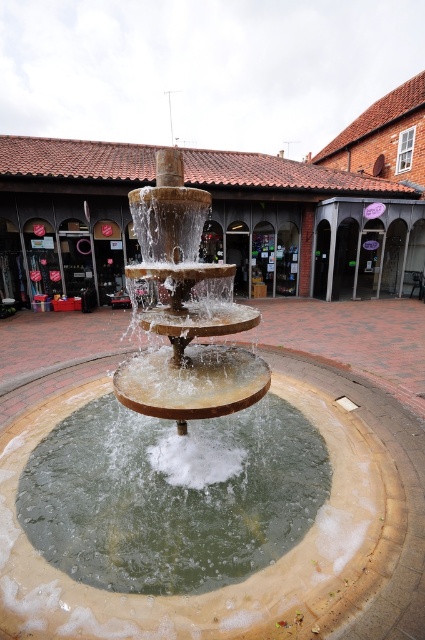
You are a landscape architect designing a new courtyard. You want to place a decorative statue that is 1.2 meters wide between the brown stone fountain at center and the green stone water at center. Based on their sizes, will the statue fit in the space between them?

The brown stone fountain at center is larger in size than the green stone water at center. Since the statue is 1.2 meters wide, it depends on the actual distance between them. However, the description only states the relative sizes, not the exact distance. Therefore, it is impossible to determine if the statue will fit without additional information about the space between them.

Based on the photo, you are standing in the courtyard and want to place a small statue on the brown stone fountain at center so that it won t fall into the green stone water at center. What should you consider about their heights?

The brown stone fountain at center is much taller than the green stone water at center, so placing the statue on the fountain will keep it above the water level and prevent it from falling in.

You are standing at the edge of the courtyard and want to walk from the brown stone fountain at center to the green stone water at center. Can you walk directly between them without stepping into the water?

The brown stone fountain at center and green stone water at center are 12.51 meters apart from each other, so yes, you can walk directly between them without stepping into the water since there is enough space between them.